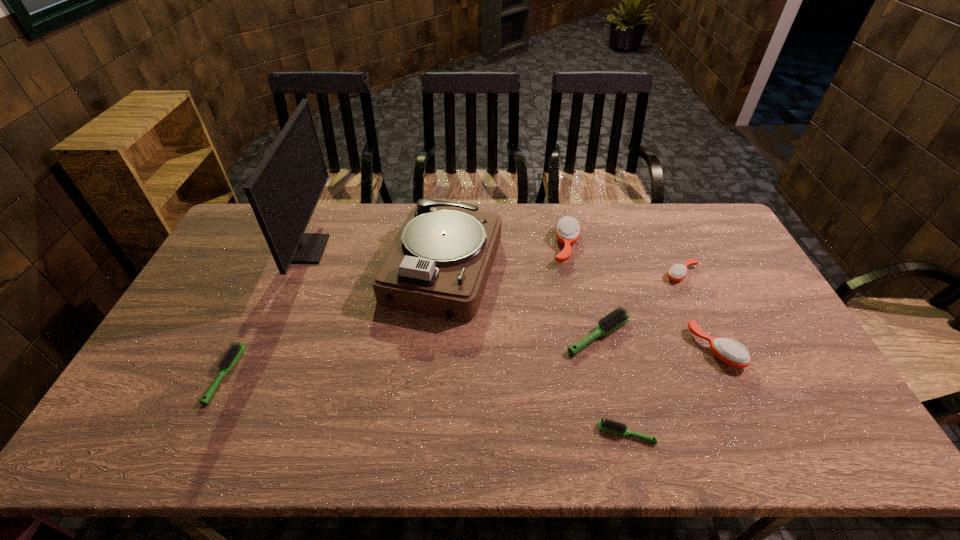
At what (x,y) coordinates should I click in order to perform the action: click on the second shortest object. Please return your answer as a coordinate pair (x, y). Looking at the image, I should click on (233, 353).

This screenshot has width=960, height=540. I want to click on the shortest hairbrush, so click(610, 426).

Image resolution: width=960 pixels, height=540 pixels. In order to click on the shortest object in this screenshot , I will do `click(610, 426)`.

Where is `free space located 0.280m on the front-facing side of the computer monitor`? This screenshot has height=540, width=960. free space located 0.280m on the front-facing side of the computer monitor is located at coordinates (407, 249).

Image resolution: width=960 pixels, height=540 pixels. In order to click on free location located on the left of the record player in this screenshot , I will do `click(264, 271)`.

Locate an element on the screen. The image size is (960, 540). vacant space situated 0.110m on the front of the tallest hairbrush is located at coordinates (576, 292).

This screenshot has height=540, width=960. I want to click on vacant point located on the back of the nearest orange hairbrush, so click(670, 249).

The width and height of the screenshot is (960, 540). What are the coordinates of `free space located on the left of the biggest light hairbrush` in the screenshot? It's located at [441, 335].

This screenshot has height=540, width=960. Find the location of `vacant space located 0.270m on the left of the smallest orange hairbrush`. vacant space located 0.270m on the left of the smallest orange hairbrush is located at coordinates (581, 274).

Locate an element on the screen. free space located on the back of the leftmost hairbrush is located at coordinates (273, 276).